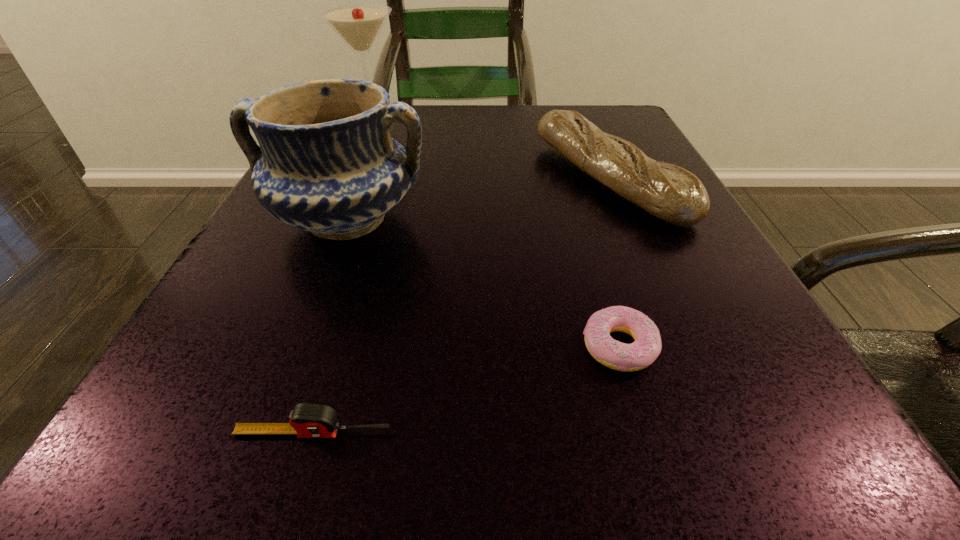
Identify the location of free spot that satisfies the following two spatial constraints: 1. on the front side of the fourth shortest object; 2. on the left side of the fourth farthest object. (296, 346).

Identify the location of free location that satisfies the following two spatial constraints: 1. on the front side of the martini; 2. on the left side of the third tallest object. This screenshot has width=960, height=540. (346, 179).

The image size is (960, 540). I want to click on free space that satisfies the following two spatial constraints: 1. on the front side of the martini; 2. on the left side of the baguet, so click(346, 179).

Where is `vacant region that satisfies the following two spatial constraints: 1. on the front side of the pottery; 2. on the right side of the second shortest object`? The width and height of the screenshot is (960, 540). vacant region that satisfies the following two spatial constraints: 1. on the front side of the pottery; 2. on the right side of the second shortest object is located at coordinates (261, 433).